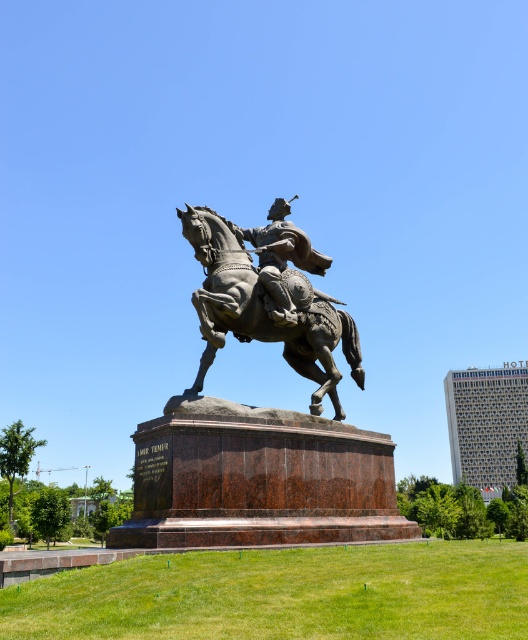
Question: Considering the real-world distances, which object is closest to the bronze textured horse at center?

Choices:
 (A) bronze helmet at center
 (B) bronze statue at center

Answer: (B)

Question: Can you confirm if bronze statue at center is positioned below bronze helmet at center?

Choices:
 (A) yes
 (B) no

Answer: (A)

Question: Considering the real-world distances, which object is farthest from the bronze helmet at center?

Choices:
 (A) bronze statue at center
 (B) bronze textured horse at center

Answer: (A)

Question: Which point is closer to the camera taking this photo?

Choices:
 (A) (215, 218)
 (B) (306, 241)
 (C) (178, 452)

Answer: (C)

Question: Can you confirm if bronze textured horse at center is bigger than bronze helmet at center?

Choices:
 (A) yes
 (B) no

Answer: (A)

Question: Does bronze textured horse at center appear on the right side of bronze helmet at center?

Choices:
 (A) no
 (B) yes

Answer: (A)